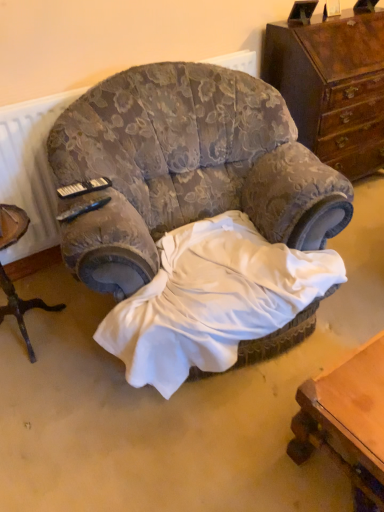
Question: Considering the relative positions of velvet floral armchair at center and white satin sheet at center in the image provided, is velvet floral armchair at center to the right of white satin sheet at center from the viewer's perspective?

Choices:
 (A) no
 (B) yes

Answer: (A)

Question: Can you confirm if velvet floral armchair at center is thinner than white satin sheet at center?

Choices:
 (A) no
 (B) yes

Answer: (A)

Question: From the image's perspective, is velvet floral armchair at center on top of white satin sheet at center?

Choices:
 (A) yes
 (B) no

Answer: (A)

Question: Is velvet floral armchair at center in contact with white satin sheet at center?

Choices:
 (A) no
 (B) yes

Answer: (A)

Question: Considering the relative sizes of velvet floral armchair at center and white satin sheet at center in the image provided, is velvet floral armchair at center smaller than white satin sheet at center?

Choices:
 (A) no
 (B) yes

Answer: (A)

Question: Is white satin sheet at center taller or shorter than wooden tripod table at left?

Choices:
 (A) tall
 (B) short

Answer: (B)

Question: Considering the positions of white satin sheet at center and wooden tripod table at left in the image, is white satin sheet at center wider or thinner than wooden tripod table at left?

Choices:
 (A) wide
 (B) thin

Answer: (A)

Question: In the image, is white satin sheet at center positioned in front of or behind wooden tripod table at left?

Choices:
 (A) front
 (B) behind

Answer: (A)

Question: From a real-world perspective, is white satin sheet at center positioned above or below wooden tripod table at left?

Choices:
 (A) above
 (B) below

Answer: (B)

Question: In terms of height, does wooden chest of drawers at upper right look taller or shorter compared to wooden tripod table at left?

Choices:
 (A) tall
 (B) short

Answer: (A)

Question: Do you think wooden chest of drawers at upper right is within wooden tripod table at left, or outside of it?

Choices:
 (A) outside
 (B) inside

Answer: (A)

Question: Is wooden chest of drawers at upper right wider or thinner than wooden tripod table at left?

Choices:
 (A) wide
 (B) thin

Answer: (A)

Question: Considering the positions of wooden chest of drawers at upper right and wooden tripod table at left in the image, is wooden chest of drawers at upper right bigger or smaller than wooden tripod table at left?

Choices:
 (A) big
 (B) small

Answer: (A)

Question: Is white satin sheet at center in front of or behind wooden chest of drawers at upper right in the image?

Choices:
 (A) front
 (B) behind

Answer: (A)

Question: Considering the positions of white satin sheet at center and wooden chest of drawers at upper right in the image, is white satin sheet at center bigger or smaller than wooden chest of drawers at upper right?

Choices:
 (A) big
 (B) small

Answer: (B)